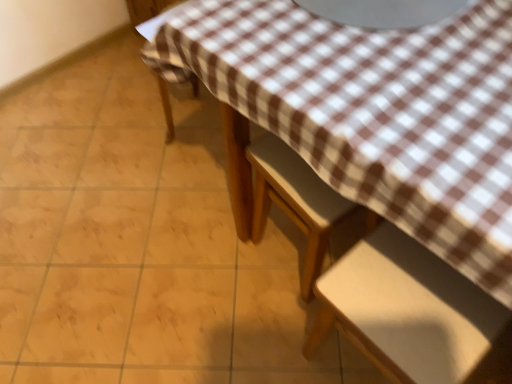
Question: Is white matte chair at lower right, marked as the 3th chair in a top-to-bottom arrangement, thinner than wooden chair at center, which is the second chair in bottom-to-top order?

Choices:
 (A) no
 (B) yes

Answer: (A)

Question: Would you say white matte chair at lower right, the first chair in the bottom-to-top sequence, is outside wooden chair at center, which is the second chair in bottom-to-top order?

Choices:
 (A) no
 (B) yes

Answer: (B)

Question: Does white matte chair at lower right, marked as the 3th chair in a top-to-bottom arrangement, have a smaller size compared to wooden chair at center, placed as the second chair when sorted from top to bottom?

Choices:
 (A) yes
 (B) no

Answer: (B)

Question: From a real-world perspective, is white matte chair at lower right, marked as the 3th chair in a top-to-bottom arrangement, positioned over wooden chair at center, which is the second chair in bottom-to-top order, based on gravity?

Choices:
 (A) yes
 (B) no

Answer: (A)

Question: Does white matte chair at lower right, the first chair in the bottom-to-top sequence, appear on the right side of wooden chair at center, placed as the second chair when sorted from top to bottom?

Choices:
 (A) yes
 (B) no

Answer: (A)

Question: From a real-world perspective, is white matte chair at lower right, marked as the 3th chair in a top-to-bottom arrangement, under wooden chair at center, placed as the second chair when sorted from top to bottom?

Choices:
 (A) yes
 (B) no

Answer: (B)

Question: Is brown checkered tablecloth at upper center shorter than white matte chair at lower right, the first chair in the bottom-to-top sequence?

Choices:
 (A) yes
 (B) no

Answer: (A)

Question: Does brown checkered tablecloth at upper center come in front of white matte chair at lower right, the first chair in the bottom-to-top sequence?

Choices:
 (A) yes
 (B) no

Answer: (B)

Question: Is brown checkered tablecloth at upper center in contact with white matte chair at lower right, the first chair in the bottom-to-top sequence?

Choices:
 (A) yes
 (B) no

Answer: (B)

Question: Can you confirm if brown checkered tablecloth at upper center is bigger than white matte chair at lower right, marked as the 3th chair in a top-to-bottom arrangement?

Choices:
 (A) no
 (B) yes

Answer: (B)

Question: Can you confirm if brown checkered tablecloth at upper center is smaller than white matte chair at lower right, the first chair in the bottom-to-top sequence?

Choices:
 (A) yes
 (B) no

Answer: (B)

Question: Is brown checkered tablecloth at upper center thinner than white matte chair at lower right, the first chair in the bottom-to-top sequence?

Choices:
 (A) yes
 (B) no

Answer: (B)

Question: From the image's perspective, is brown checkered tablecloth at upper center on wooden chair at center, which is the second chair in bottom-to-top order?

Choices:
 (A) no
 (B) yes

Answer: (A)